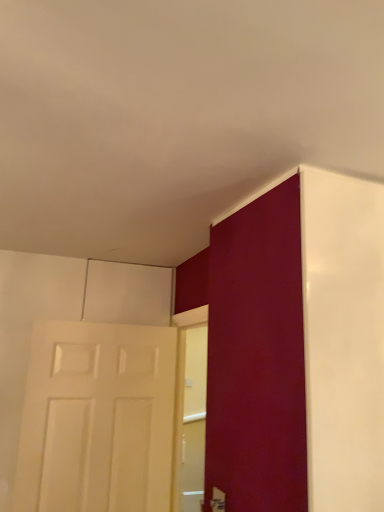
Where is `white matte door at left, the 2th door positioned from the front`? The height and width of the screenshot is (512, 384). white matte door at left, the 2th door positioned from the front is located at coordinates (97, 419).

Describe the element at coordinates (97, 419) in the screenshot. I see `white matte door at left, arranged as the 1th door when viewed from the back` at that location.

In order to face white matte door at left, which appears as the second door when viewed from the right, should I rotate leftwards or rightwards?

Rotate left and turn 14.747 degrees.

I want to click on matte white door at right, which is counted as the 1th door, starting from the front, so click(257, 357).

Describe the element at coordinates (257, 357) in the screenshot. I see `matte white door at right, the first door viewed from the right` at that location.

This screenshot has height=512, width=384. I want to click on white matte door at left, arranged as the 1th door when viewed from the back, so click(97, 419).

Which object is positioned more to the left, white matte door at left, the first door viewed from the left, or matte white door at right, which is counted as the 1th door, starting from the front?

white matte door at left, the first door viewed from the left.

Which object is further away from the camera taking this photo, white matte door at left, the 2th door positioned from the front, or matte white door at right, the second door viewed from the left?

Positioned behind is white matte door at left, the 2th door positioned from the front.

Considering the points (129, 366) and (247, 510), which point is in front, point (129, 366) or point (247, 510)?

The point (247, 510) is closer.

Looking at this image, from the image's perspective, is white matte door at left, which appears as the second door when viewed from the right, located beneath matte white door at right, which is counted as the 1th door, starting from the front?

Yes, from the image's perspective, white matte door at left, which appears as the second door when viewed from the right, is below matte white door at right, which is counted as the 1th door, starting from the front.

From a real-world perspective, is white matte door at left, the 2th door positioned from the front, located higher than matte white door at right, which is counted as the 1th door, starting from the front?

Actually, white matte door at left, the 2th door positioned from the front, is physically below matte white door at right, which is counted as the 1th door, starting from the front, in the real world.

Is white matte door at left, the 2th door positioned from the front, wider than matte white door at right, placed as the 2th door when sorted from back to front?

In fact, white matte door at left, the 2th door positioned from the front, might be narrower than matte white door at right, placed as the 2th door when sorted from back to front.

Considering the sizes of objects white matte door at left, which appears as the second door when viewed from the right, and matte white door at right, the first door viewed from the right, in the image provided, who is taller, white matte door at left, which appears as the second door when viewed from the right, or matte white door at right, the first door viewed from the right,?

With more height is white matte door at left, which appears as the second door when viewed from the right.

Looking at the image, does white matte door at left, the 2th door positioned from the front, seem bigger or smaller compared to matte white door at right, the first door viewed from the right?

white matte door at left, the 2th door positioned from the front, is smaller than matte white door at right, the first door viewed from the right.

Is white matte door at left, the first door viewed from the left, surrounding matte white door at right, placed as the 2th door when sorted from back to front?

Actually, matte white door at right, placed as the 2th door when sorted from back to front, is outside white matte door at left, the first door viewed from the left.

Is there a large distance between white matte door at left, the 2th door positioned from the front, and matte white door at right, the second door viewed from the left?

white matte door at left, the 2th door positioned from the front, is actually quite close to matte white door at right, the second door viewed from the left.

Could you tell me if white matte door at left, arranged as the 1th door when viewed from the back, is facing matte white door at right, which is counted as the 1th door, starting from the front?

Yes, white matte door at left, arranged as the 1th door when viewed from the back, is aimed at matte white door at right, which is counted as the 1th door, starting from the front.

How different are the orientations of white matte door at left, which appears as the second door when viewed from the right, and matte white door at right, the first door viewed from the right, in degrees?

They differ by 0.66 degrees in their facing directions.

The image size is (384, 512). I want to click on door above the white matte door at left, the first door viewed from the left (from the image's perspective), so click(257, 357).

Consider the image. Can you confirm if matte white door at right, which is counted as the 1th door, starting from the front, is positioned to the right of white matte door at left, arranged as the 1th door when viewed from the back?

Yes, matte white door at right, which is counted as the 1th door, starting from the front, is to the right of white matte door at left, arranged as the 1th door when viewed from the back.

Is matte white door at right, the first door viewed from the right, in front of white matte door at left, arranged as the 1th door when viewed from the back?

That is True.

In the scene shown: Which point is more forward, (278, 370) or (78, 433)?

The point (278, 370) is closer to the camera.

From the image's perspective, which one is positioned higher, matte white door at right, which is counted as the 1th door, starting from the front, or white matte door at left, arranged as the 1th door when viewed from the back?

matte white door at right, which is counted as the 1th door, starting from the front, from the image's perspective.

From a real-world perspective, relative to white matte door at left, the 2th door positioned from the front, is matte white door at right, the second door viewed from the left, vertically above or below?

matte white door at right, the second door viewed from the left, is above white matte door at left, the 2th door positioned from the front.

Is matte white door at right, the first door viewed from the right, wider or thinner than white matte door at left, which appears as the second door when viewed from the right?

Considering their sizes, matte white door at right, the first door viewed from the right, looks broader than white matte door at left, which appears as the second door when viewed from the right.

Does matte white door at right, the first door viewed from the right, have a lesser height compared to white matte door at left, the first door viewed from the left?

Indeed, matte white door at right, the first door viewed from the right, has a lesser height compared to white matte door at left, the first door viewed from the left.

Considering the relative sizes of matte white door at right, placed as the 2th door when sorted from back to front, and white matte door at left, which appears as the second door when viewed from the right, in the image provided, is matte white door at right, placed as the 2th door when sorted from back to front, bigger than white matte door at left, which appears as the second door when viewed from the right,?

Correct, matte white door at right, placed as the 2th door when sorted from back to front, is larger in size than white matte door at left, which appears as the second door when viewed from the right.

Is matte white door at right, placed as the 2th door when sorted from back to front, located outside white matte door at left, the 2th door positioned from the front?

matte white door at right, placed as the 2th door when sorted from back to front, lies outside white matte door at left, the 2th door positioned from the front,'s area.

Is matte white door at right, placed as the 2th door when sorted from back to front, far away from white matte door at left, which appears as the second door when viewed from the right?

matte white door at right, placed as the 2th door when sorted from back to front, is near white matte door at left, which appears as the second door when viewed from the right, not far away.

Is matte white door at right, placed as the 2th door when sorted from back to front, positioned with its back to white matte door at left, the 2th door positioned from the front?

No.

How many degrees apart are the facing directions of matte white door at right, which is counted as the 1th door, starting from the front, and white matte door at left, arranged as the 1th door when viewed from the back?

They differ by 0.66 degrees in their facing directions.

Locate an element on the screen. door located above the white matte door at left, the first door viewed from the left (from a real-world perspective) is located at coordinates (257, 357).

This screenshot has width=384, height=512. What are the coordinates of `door below the matte white door at right, placed as the 2th door when sorted from back to front (from a real-world perspective)` in the screenshot? It's located at (97, 419).

Locate an element on the screen. The width and height of the screenshot is (384, 512). door behind the matte white door at right, the second door viewed from the left is located at coordinates [x=97, y=419].